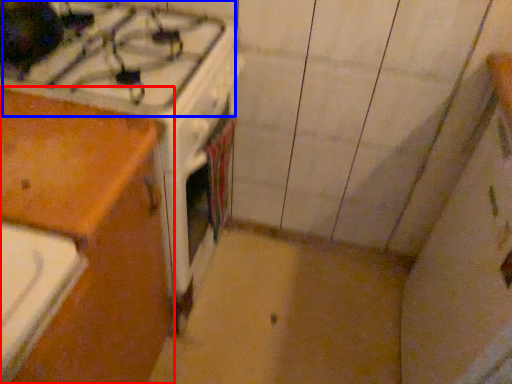
Question: Which of the following is the closest to the observer, cabinetry (highlighted by a red box) or gas stove (highlighted by a blue box)?

Choices:
 (A) cabinetry
 (B) gas stove

Answer: (A)